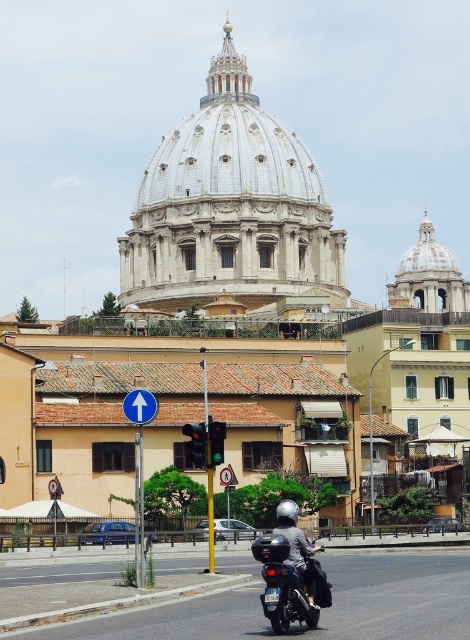
Does shiny black motorcycle at center have a lesser height compared to silver metallic helmet at center?

No.

Between shiny black motorcycle at center and silver metallic helmet at center, which one is positioned lower?

silver metallic helmet at center is below.

This screenshot has width=470, height=640. What do you see at coordinates (290, 572) in the screenshot?
I see `shiny black motorcycle at center` at bounding box center [290, 572].

The height and width of the screenshot is (640, 470). Identify the location of shiny black motorcycle at center. (290, 572).

Which is above, white marble dome at center or silver metallic helmet at center?

white marble dome at center is above.

Is white marble dome at center above silver metallic helmet at center?

Yes, white marble dome at center is above silver metallic helmet at center.

At what (x,y) coordinates should I click in order to perform the action: click on white marble dome at center. Please return your answer as a coordinate pair (x, y). This screenshot has width=470, height=640. Looking at the image, I should click on (232, 211).

Can you confirm if white marble dome at center is positioned to the left of blue metallic signpost at upper center?

Yes, white marble dome at center is to the left of blue metallic signpost at upper center.

Which of these two, white marble dome at center or blue metallic signpost at upper center, stands shorter?

Standing shorter between the two is blue metallic signpost at upper center.

Describe the element at coordinates (232, 211) in the screenshot. Image resolution: width=470 pixels, height=640 pixels. I see `white marble dome at center` at that location.

Where is `white marble dome at center`? white marble dome at center is located at coordinates (232, 211).